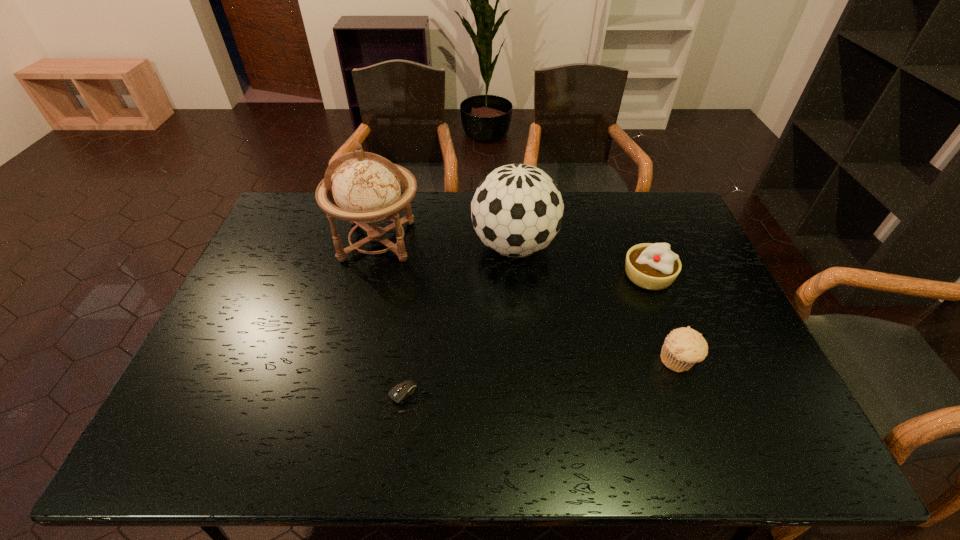
I want to click on vacant area that lies between the tallest object and the soccer ball, so click(446, 244).

This screenshot has width=960, height=540. Find the location of `vacant area that lies between the globe and the shortest object`. vacant area that lies between the globe and the shortest object is located at coordinates (391, 324).

Identify the location of vacant space that's between the tallest object and the third tallest object. The height and width of the screenshot is (540, 960). (513, 258).

This screenshot has width=960, height=540. I want to click on the closest object relative to the third tallest object, so click(683, 347).

Identify the location of the fourth closest object to the third shortest object. (401, 391).

This screenshot has width=960, height=540. What are the coordinates of `blank space that satisfies the following two spatial constraints: 1. on the back side of the third tallest object; 2. on the left side of the shortest object` in the screenshot? It's located at (420, 276).

The height and width of the screenshot is (540, 960). Find the location of `free space that satisfies the following two spatial constraints: 1. on the front side of the fourth farthest object; 2. on the right side of the third object from left to right`. free space that satisfies the following two spatial constraints: 1. on the front side of the fourth farthest object; 2. on the right side of the third object from left to right is located at coordinates (524, 361).

Where is `free point that satisfies the following two spatial constraints: 1. on the front-facing side of the third object from right to left; 2. on the right side of the globe`? Image resolution: width=960 pixels, height=540 pixels. free point that satisfies the following two spatial constraints: 1. on the front-facing side of the third object from right to left; 2. on the right side of the globe is located at coordinates (376, 246).

In order to click on free space that satisfies the following two spatial constraints: 1. on the front-facing side of the tallest object; 2. on the right side of the soccer ball in this screenshot , I will do `click(376, 246)`.

Where is `free location that satisfies the following two spatial constraints: 1. on the back side of the nearest object; 2. on the left side of the muffin`? The image size is (960, 540). free location that satisfies the following two spatial constraints: 1. on the back side of the nearest object; 2. on the left side of the muffin is located at coordinates (409, 361).